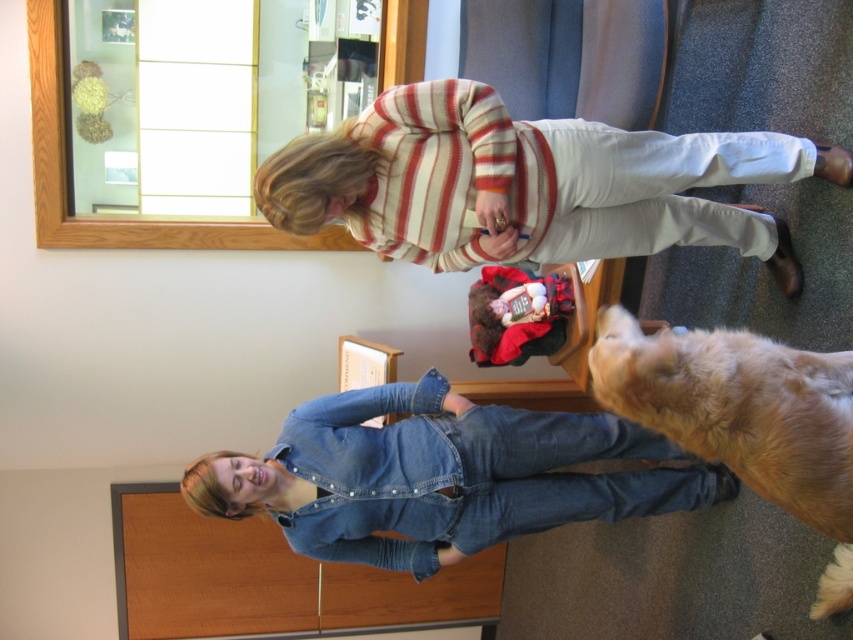
Is denim overalls at lower center to the left of golden fur dog at lower right from the viewer's perspective?

Indeed, denim overalls at lower center is positioned on the left side of golden fur dog at lower right.

The height and width of the screenshot is (640, 853). What do you see at coordinates (440, 476) in the screenshot? I see `denim overalls at lower center` at bounding box center [440, 476].

The image size is (853, 640). In order to click on denim overalls at lower center in this screenshot , I will do `click(440, 476)`.

Is striped sweater at upper center to the left of denim overalls at lower center from the viewer's perspective?

In fact, striped sweater at upper center is to the right of denim overalls at lower center.

Who is positioned more to the left, striped sweater at upper center or denim overalls at lower center?

denim overalls at lower center

Is point (422, 97) more distant than point (473, 529)?

No, (422, 97) is in front of (473, 529).

The height and width of the screenshot is (640, 853). Find the location of `striped sweater at upper center`. striped sweater at upper center is located at coordinates (527, 182).

Can you confirm if striped sweater at upper center is shorter than golden fur dog at lower right?

Yes.

Is the position of striped sweater at upper center less distant than that of golden fur dog at lower right?

No, striped sweater at upper center is behind golden fur dog at lower right.

Between point (605, 152) and point (801, 397), which one is positioned behind?

Point (605, 152)

Locate an element on the screen. The height and width of the screenshot is (640, 853). striped sweater at upper center is located at coordinates (527, 182).